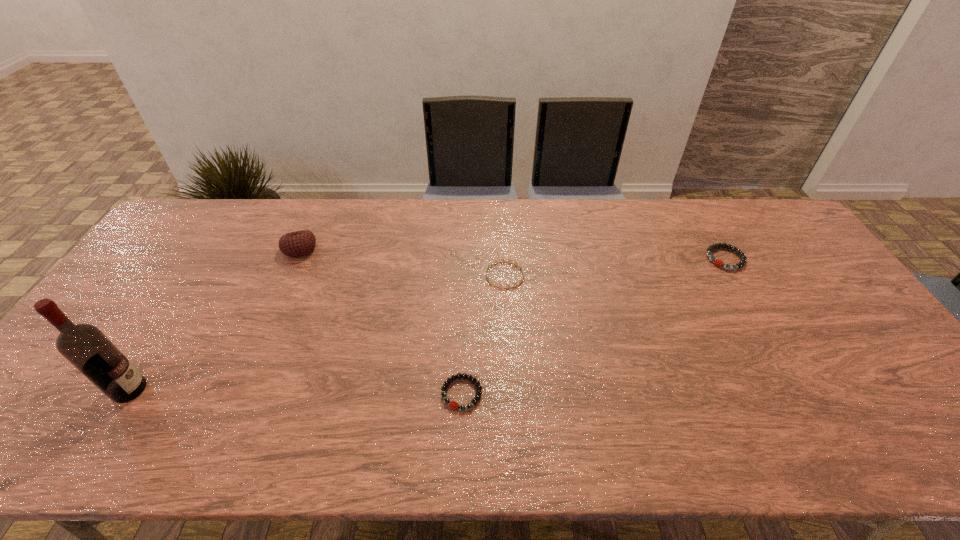
Where is `free spot located on the right of the second object from left to right`? free spot located on the right of the second object from left to right is located at coordinates (336, 249).

At what (x,y) coordinates should I click in order to perform the action: click on vacant region located on the left of the rightmost object. Please return your answer as a coordinate pair (x, y). Looking at the image, I should click on (612, 259).

At what (x,y) coordinates should I click in order to perform the action: click on vacant space situated on the surface of the second object from right to left showing star-shaped elements. Please return your answer as a coordinate pair (x, y). The image size is (960, 540). Looking at the image, I should click on (420, 275).

Locate an element on the screen. The width and height of the screenshot is (960, 540). vacant space located 0.310m on the surface of the second object from right to left showing star-shaped elements is located at coordinates (384, 275).

This screenshot has height=540, width=960. I want to click on free space located on the surface of the second object from right to left showing star-shaped elements, so click(x=449, y=275).

Locate an element on the screen. This screenshot has height=540, width=960. vacant space located 0.160m on the right of the leftmost bracelet is located at coordinates (549, 394).

Identify the location of object that is at the far edge. (298, 243).

Find the location of `free space at the far edge of the desktop`. free space at the far edge of the desktop is located at coordinates (574, 205).

Identify the location of vacant space at the near edge of the desktop. The height and width of the screenshot is (540, 960). (684, 450).

This screenshot has height=540, width=960. What are the coordinates of `vacant space at the right edge` in the screenshot? It's located at (795, 253).